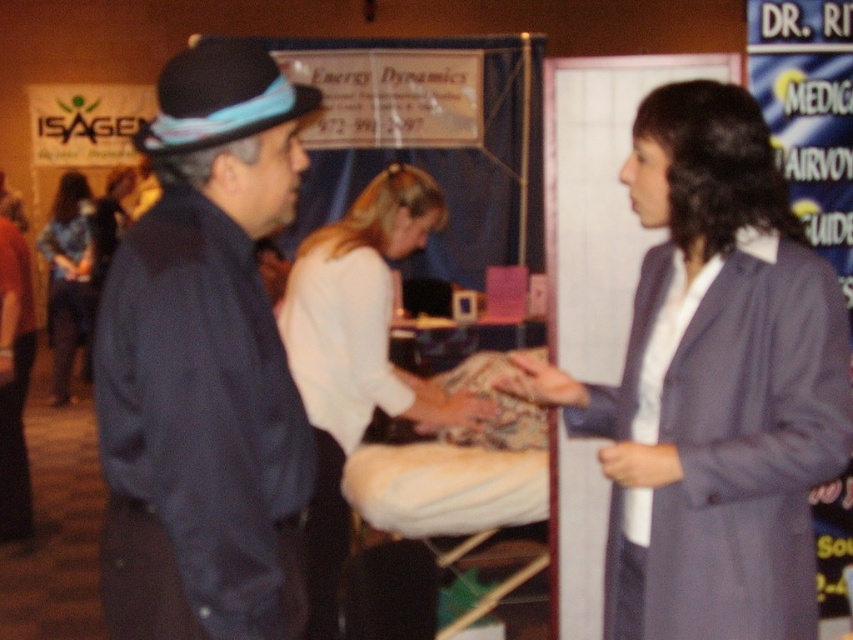
You are a tailor observing the man at the left side of the image. You need to determine if his dark blue fabric jacket at left can fit into the same storage compartment as his denim pants at left. The compartment can only accommodate items narrower than the pants. Can the jacket fit?

The dark blue fabric jacket at left has a width less than the denim pants at left, so it can fit into the storage compartment designed for items narrower than the pants.

Based on the scene description, what are the coordinates of the dark blue fabric jacket at left?

The dark blue fabric jacket at left is located at coordinates 0.573 on the x axis and 0.242 on the y axis.

You are a fashion designer observing the convention attendees. You notice the black felt fedora at left and the denim pants at left. Which item of clothing is smaller in size?

The black felt fedora at left has a smaller size compared to the denim pants at left.